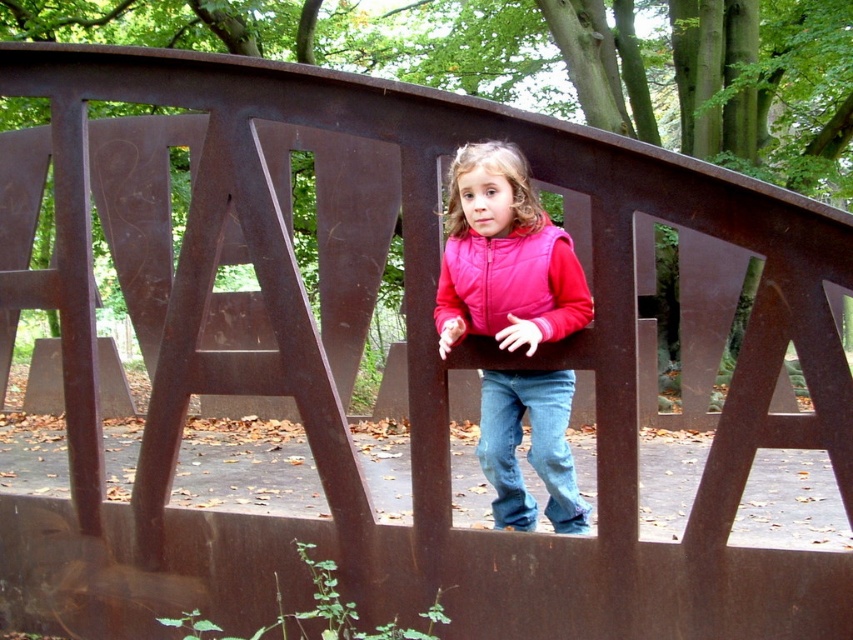
Can you confirm if pink matte vest at center is bigger than jeans at center?

Indeed, pink matte vest at center has a larger size compared to jeans at center.

Based on the photo, can you confirm if pink matte vest at center is smaller than jeans at center?

No, pink matte vest at center is not smaller than jeans at center.

The height and width of the screenshot is (640, 853). I want to click on pink matte vest at center, so click(x=503, y=257).

Can you confirm if pink matte vest at center is shorter than pink quilted vest at center?

No.

Does pink matte vest at center appear over pink quilted vest at center?

Actually, pink matte vest at center is below pink quilted vest at center.

Which is in front, point (543, 305) or point (544, 292)?

Point (544, 292)

What are the coordinates of `pink matte vest at center` in the screenshot? It's located at (503, 257).

Who is shorter, pink quilted vest at center or jeans at center?

Standing shorter between the two is pink quilted vest at center.

Measure the distance from pink quilted vest at center to jeans at center.

A distance of 20.72 inches exists between pink quilted vest at center and jeans at center.

Between point (439, 296) and point (555, 528), which one is positioned in front?

Positioned in front is point (439, 296).

Locate an element on the screen. pink quilted vest at center is located at coordinates (514, 282).